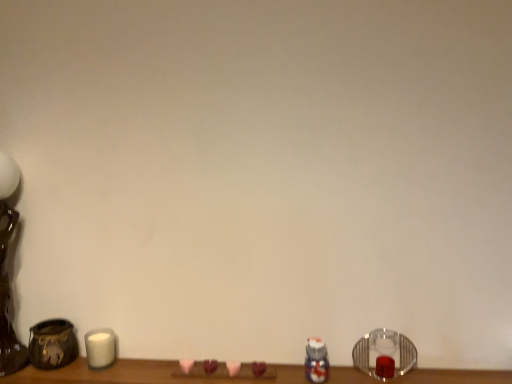
Question: Considering the relative sizes of matte brown vase at left and clear glass candle holder at lower right in the image provided, is matte brown vase at left shorter than clear glass candle holder at lower right?

Choices:
 (A) no
 (B) yes

Answer: (B)

Question: From the image's perspective, is matte brown vase at left above clear glass candle holder at lower right?

Choices:
 (A) yes
 (B) no

Answer: (A)

Question: Can you confirm if matte brown vase at left is bigger than clear glass candle holder at lower right?

Choices:
 (A) no
 (B) yes

Answer: (B)

Question: Is clear glass candle holder at lower right surrounded by matte brown vase at left?

Choices:
 (A) no
 (B) yes

Answer: (A)

Question: From a real-world perspective, is matte brown vase at left under clear glass candle holder at lower right?

Choices:
 (A) yes
 (B) no

Answer: (B)

Question: From a real-world perspective, is matte brown vase at left on top of clear glass candle holder at lower right?

Choices:
 (A) no
 (B) yes

Answer: (B)

Question: From the image's perspective, is brushed metal table lamp at left on top of translucent plastic toy at lower right?

Choices:
 (A) no
 (B) yes

Answer: (B)

Question: Does brushed metal table lamp at left have a larger size compared to translucent plastic toy at lower right?

Choices:
 (A) no
 (B) yes

Answer: (B)

Question: Does brushed metal table lamp at left have a smaller size compared to translucent plastic toy at lower right?

Choices:
 (A) no
 (B) yes

Answer: (A)

Question: From a real-world perspective, is brushed metal table lamp at left located beneath translucent plastic toy at lower right?

Choices:
 (A) yes
 (B) no

Answer: (B)

Question: Is brushed metal table lamp at left positioned behind translucent plastic toy at lower right?

Choices:
 (A) no
 (B) yes

Answer: (A)

Question: Is brushed metal table lamp at left positioned with its back to translucent plastic toy at lower right?

Choices:
 (A) no
 (B) yes

Answer: (A)

Question: Does brushed metal table lamp at left have a smaller size compared to clear glass candle holder at lower right?

Choices:
 (A) yes
 (B) no

Answer: (B)